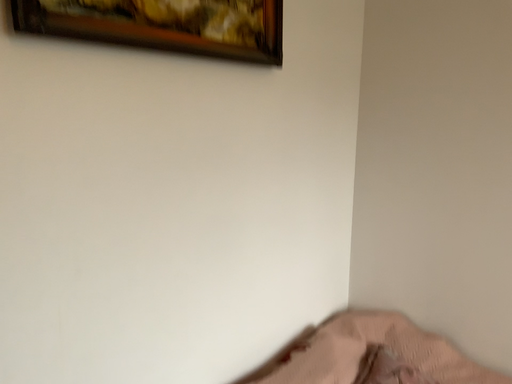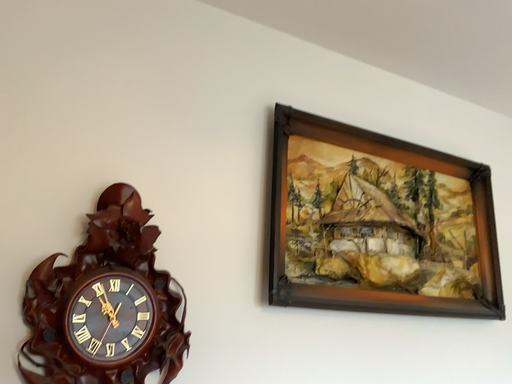
Question: How did the camera likely rotate when shooting the video?

Choices:
 (A) rotated downward
 (B) rotated upward

Answer: (B)